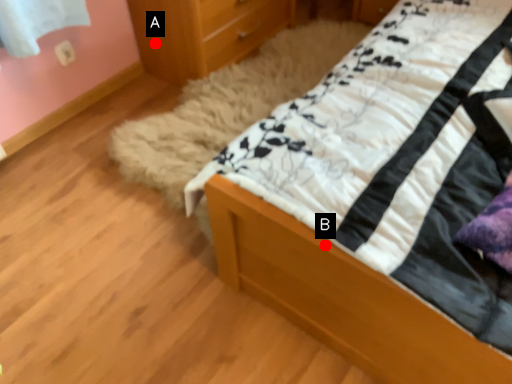
Question: Two points are circled on the image, labeled by A and B beside each circle. Which point appears closest to the camera in this image?

Choices:
 (A) A is closer
 (B) B is closer

Answer: (B)